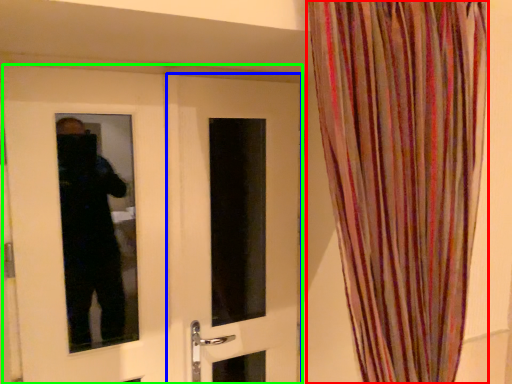
Question: Which object is the farthest from curtain (highlighted by a red box)? Choose among these: door (highlighted by a blue box) or door (highlighted by a green box).

Choices:
 (A) door
 (B) door

Answer: (B)